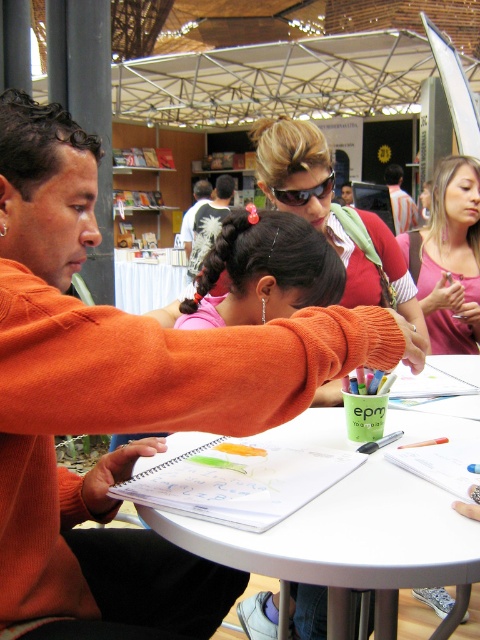
Question: Which of the following is the farthest from the observer?

Choices:
 (A) pink fabric shirt at upper right
 (B) striped shirt at upper right
 (C) sunglasses at center
 (D) white plastic table at center

Answer: (B)

Question: Is pink fabric shirt at upper right bigger than white feathered shirt at center?

Choices:
 (A) no
 (B) yes

Answer: (A)

Question: Which point is closer to the camera taking this photo?

Choices:
 (A) (394, 598)
 (B) (189, 216)
 (C) (420, 288)
 (D) (296, 193)

Answer: (A)

Question: Considering the relative positions of white plastic table at center and striped shirt at upper right in the image provided, where is white plastic table at center located with respect to striped shirt at upper right?

Choices:
 (A) below
 (B) above

Answer: (A)

Question: Is striped shirt at upper right further to the viewer compared to sunglasses at center?

Choices:
 (A) no
 (B) yes

Answer: (B)

Question: Which point is farther to the camera?

Choices:
 (A) (452, 426)
 (B) (186, 228)
 (C) (204, 211)

Answer: (B)